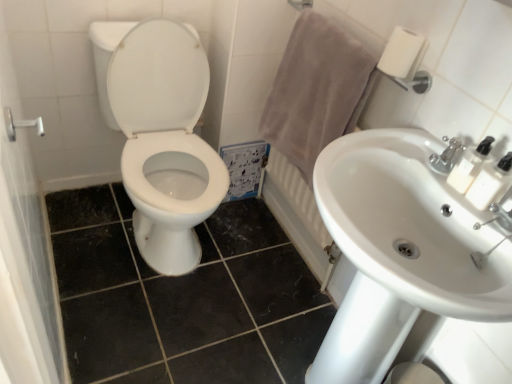
Question: Based on their sizes in the image, would you say white plastic soap dispenser at upper right, marked as the second soap dispenser in a bottom-to-top arrangement, is bigger or smaller than white ceramic radiator at upper right?

Choices:
 (A) small
 (B) big

Answer: (A)

Question: Is white plastic soap dispenser at upper right, which ranks as the 1th soap dispenser in top-to-bottom order, wider or thinner than white ceramic radiator at upper right?

Choices:
 (A) thin
 (B) wide

Answer: (B)

Question: Based on their relative distances, which object is farther from the white glossy toilet at center?

Choices:
 (A) white plastic soap dispenser at upper right, which is counted as the second soap dispenser, starting from the top
 (B) white ceramic radiator at upper right
 (C) white plastic soap dispenser at upper right, which ranks as the 1th soap dispenser in top-to-bottom order
 (D) beige cotton towel at upper right
 (E) white glossy sink at center right

Answer: (A)

Question: Which of these objects is positioned closest to the brushed metal shower handle at left?

Choices:
 (A) white ceramic faucet at upper right
 (B) white plastic soap dispenser at upper right, which is counted as the second soap dispenser, starting from the top
 (C) white plastic soap dispenser at upper right, which ranks as the 1th soap dispenser in top-to-bottom order
 (D) white glossy toilet at center
 (E) white ceramic radiator at upper right

Answer: (D)